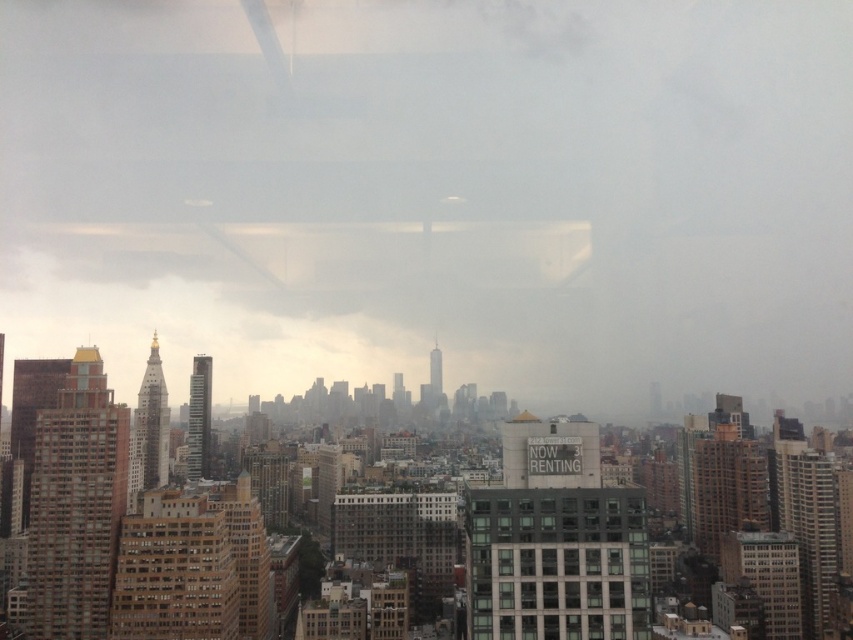
Consider the image. You are an architect analyzing the cityscape. You notice the transparent glass cloud at center and the dark gray glass windows at center. Which of these two objects is bigger in size?

The transparent glass cloud at center has a larger size compared to dark gray glass windows at center.

You are an architect designing a new building in the city. You want to place a large sculpture exactly at the center of the transparent glass cloud at center. What are the coordinates where you should place it?

The coordinates for placing the sculpture at the center of the transparent glass cloud at center are exactly at point (434, 193).